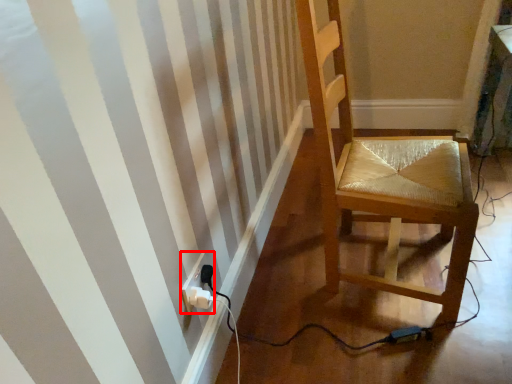
Question: From the image's perspective, where is electric outlet (annotated by the red box) located relative to chair?

Choices:
 (A) above
 (B) below

Answer: (B)